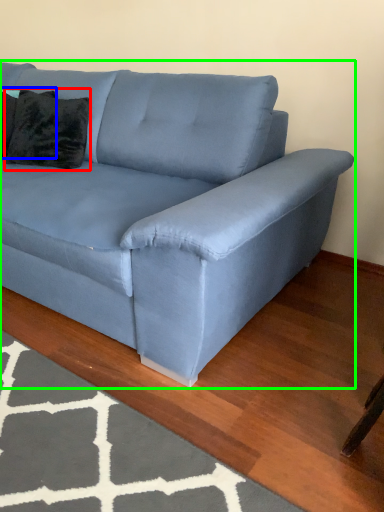
Question: Which object is positioned closest to pillow (highlighted by a red box)? Select from pillow (highlighted by a blue box) and studio couch (highlighted by a green box).

Choices:
 (A) pillow
 (B) studio couch

Answer: (A)